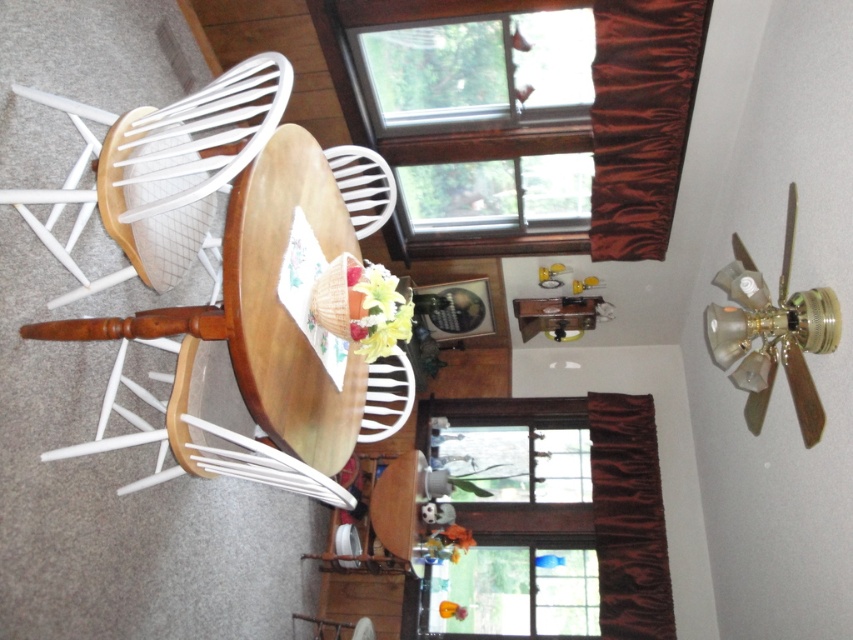
Measure the distance between point [474,157] and camera.

The distance of point [474,157] from camera is 3.84 meters.

This screenshot has height=640, width=853. Identify the location of brown wood window at upper center. tap(477, 109).

You are a GUI agent. You are given a task and a screenshot of the screen. Output one action in this format:
    pyautogui.click(x=<x>, y=<y>)
    Task: Click on the brown wood window at upper center
    The image size is (853, 640).
    Given the screenshot: What is the action you would take?
    pyautogui.click(x=477, y=109)

Between wooden chair at center and white painted wood chair at left, which one is positioned higher?

white painted wood chair at left is above.

Does wooden chair at center have a greater width compared to white painted wood chair at left?

Indeed, wooden chair at center has a greater width compared to white painted wood chair at left.

Identify the location of wooden chair at center. The width and height of the screenshot is (853, 640). (252, 337).

Between point (372, 124) and point (492, 497), which one is positioned behind?

The point (492, 497) is behind.

Image resolution: width=853 pixels, height=640 pixels. In order to click on brown wood window at upper center in this screenshot , I will do `click(477, 109)`.